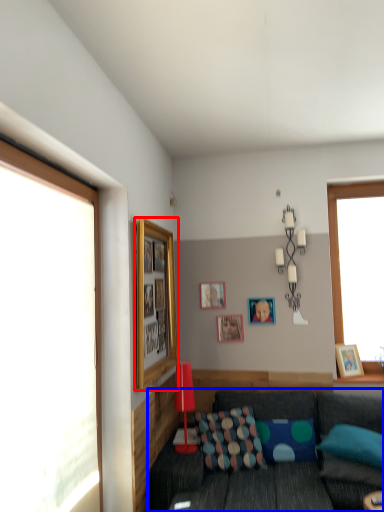
Question: Which of the following is the closest to the observer, picture frame (highlighted by a red box) or studio couch (highlighted by a blue box)?

Choices:
 (A) picture frame
 (B) studio couch

Answer: (B)